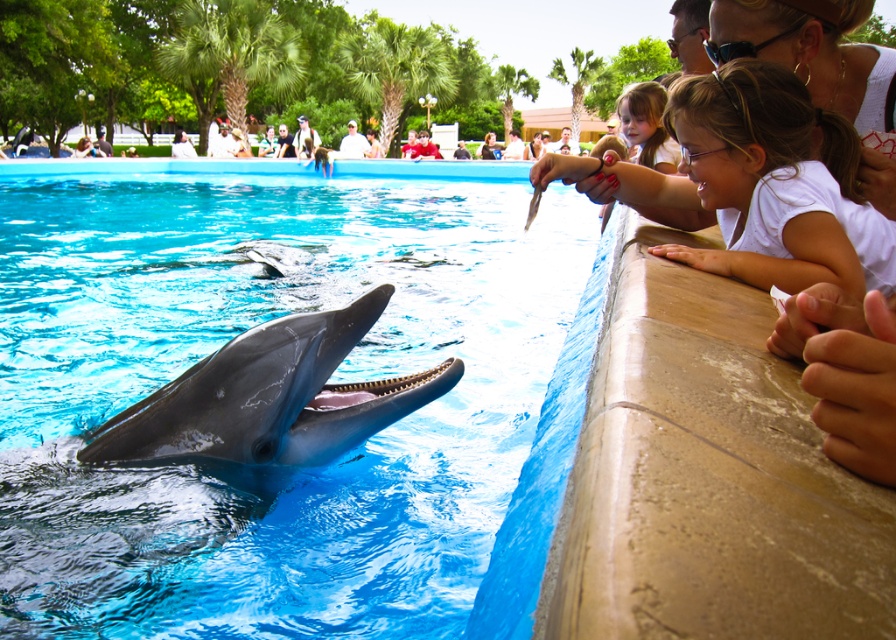
You are a photographer standing at the dolphin show. You want to take a photo of the blue smooth water at center and the white matte hair at upper right in the same frame. The camera you have can capture objects within a 5 meter range. Will both objects fit in the photo?

The blue smooth water at center and white matte hair at upper right are 4.67 meters apart, so yes, both objects will fit in the photo since the distance between them is within the camera range of 5 meters.